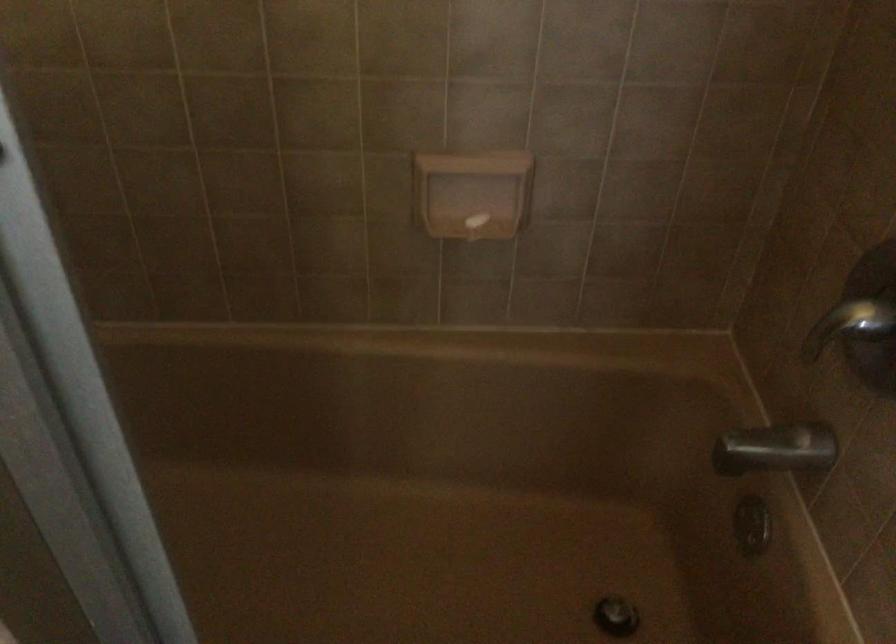
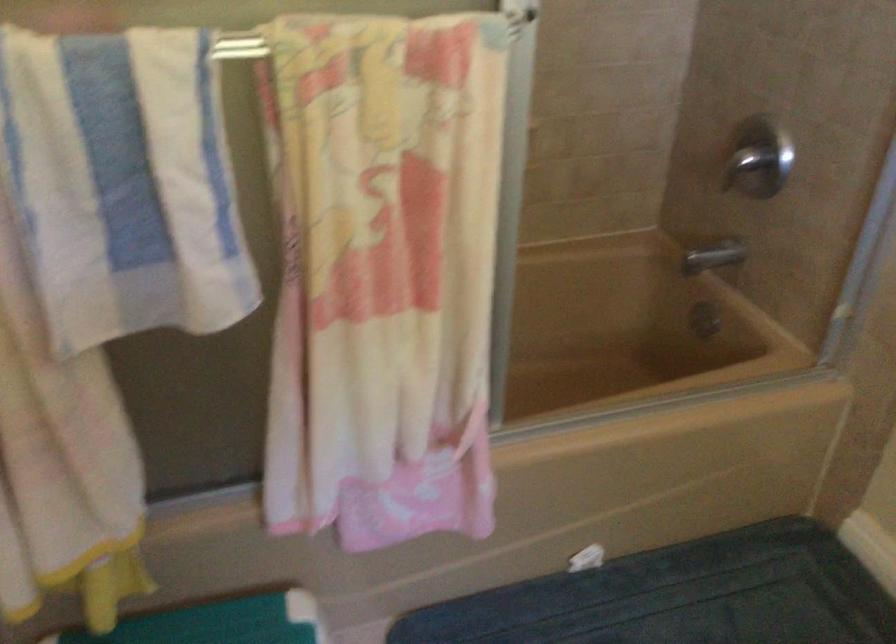
Question: The camera is either moving clockwise (left) or counter-clockwise (right) around the object. The first image is from the beginning of the video and the second image is from the end. Is the camera moving left or right when shooting the video?

Choices:
 (A) Left
 (B) Right

Answer: (A)